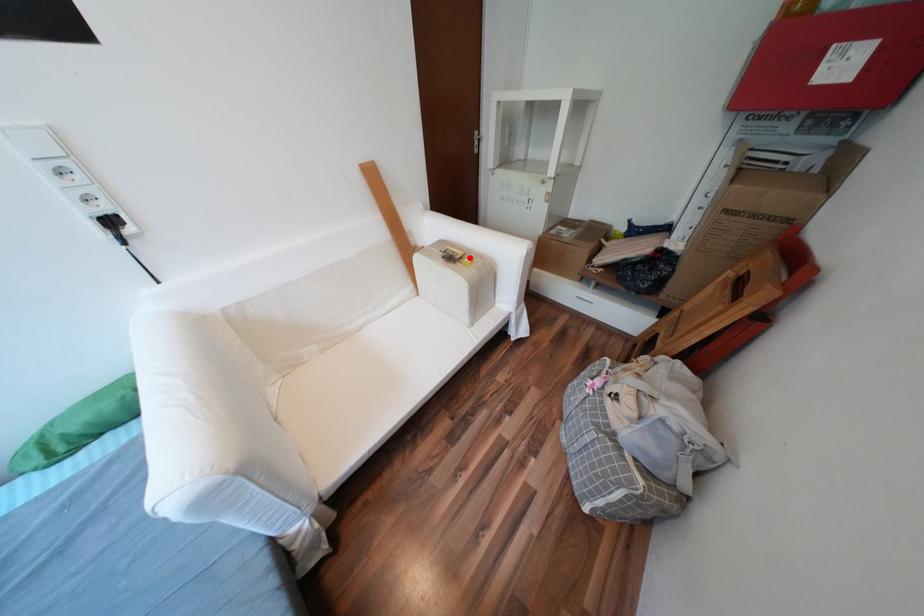
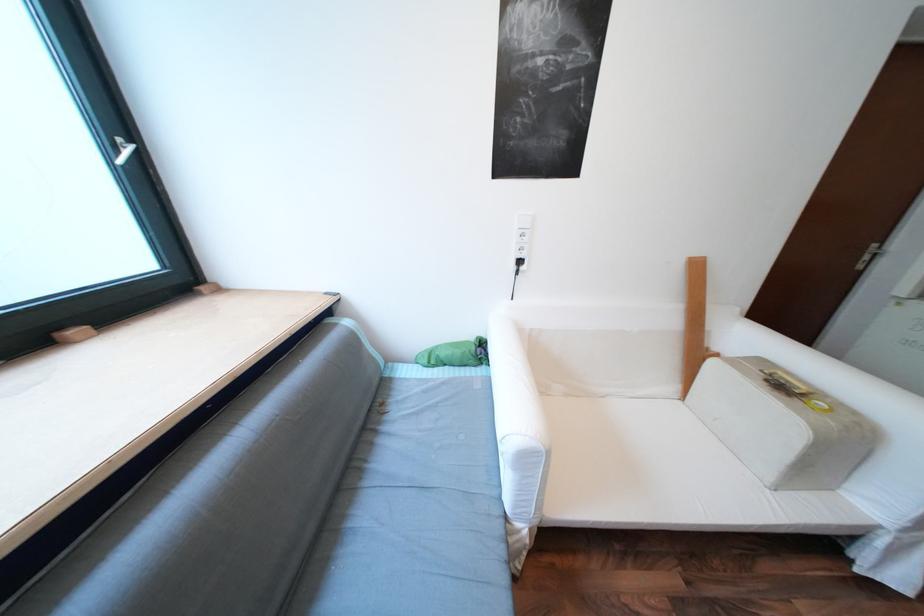
Find the pixel in the second image that matches the highlighted location in the first image.

(811, 394)